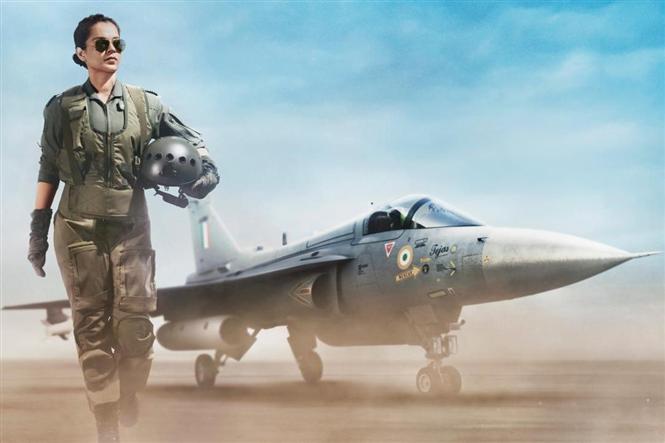
This screenshot has height=443, width=665. What are the coordinates of `decals` in the screenshot? It's located at (388, 250), (423, 243), (438, 255), (408, 262), (408, 273), (435, 296).